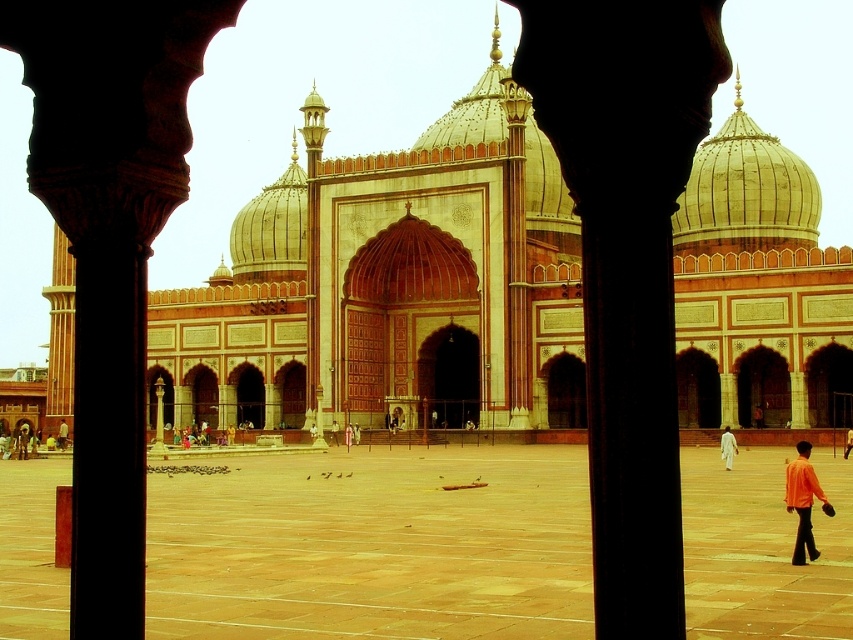
You are standing at the entrance of the courtyard and see the point marked at coordinates (758, 285). What does this point represent?

The point marked at coordinates (758, 285) represents the smooth stone palace at center.

You are standing in the courtyard of the mosque and need to take a photo of the smooth stone palace at center without including the orange cotton shirt at lower right in the frame. Based on their positions, is this possible?

Yes, since the smooth stone palace at center is located above the orange cotton shirt at lower right, you can adjust your camera angle to capture the palace while avoiding the shirt by aiming upwards or moving to a position where the shirt is out of the frame.

You are standing in the courtyard of the mosque and want to take a photo of the smooth stone palace at center and the white cotton person at center. Which object should you frame first in your camera viewfinder to ensure both are in the shot?

You should frame the smooth stone palace at center first because it is positioned to the left of the white cotton person at center, so starting with the left side ensures both are included in the photo.